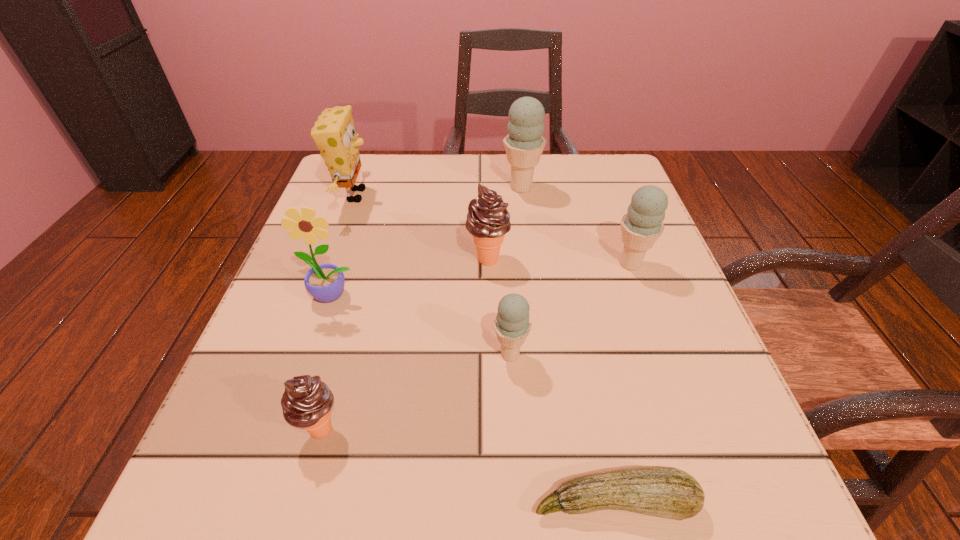
Locate an element on the screen. This screenshot has width=960, height=540. icecream object that ranks as the third closest to the rightmost icecream is located at coordinates [512, 325].

Locate which icecream is the third closest to the shortest object. Please provide its 2D coordinates. Your answer should be formatted as a tuple, i.e. [(x, y)], where the tuple contains the x and y coordinates of a point satisfying the conditions above.

[(642, 225)]

Find the location of a particular element. the second closest blue ice cream to the green zucchini is located at coordinates (642, 225).

Locate an element on the screen. This screenshot has width=960, height=540. blue ice cream that stands as the closest to the rightmost blue ice cream is located at coordinates (524, 144).

This screenshot has height=540, width=960. In order to click on vacant space that satisfies the following two spatial constraints: 1. on the face of the sponge; 2. on the back side of the third nearest object in this screenshot , I will do `click(298, 354)`.

At what (x,y) coordinates should I click in order to perform the action: click on free space that satisfies the following two spatial constraints: 1. on the face of the sponge; 2. on the right side of the left chocolate icecream. Please return your answer as a coordinate pair (x, y). Looking at the image, I should click on (270, 429).

The width and height of the screenshot is (960, 540). In order to click on free space that satisfies the following two spatial constraints: 1. on the face of the sponge; 2. on the back side of the sixth farthest object in this screenshot , I will do `click(298, 354)`.